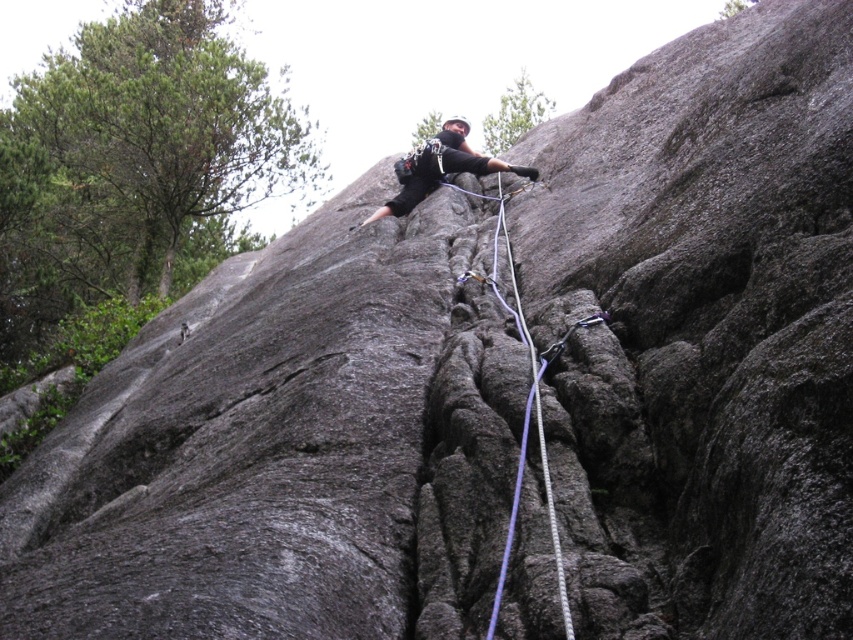
Question: Which point is farther from the camera taking this photo?

Choices:
 (A) (426, 140)
 (B) (538, 435)

Answer: (A)

Question: Is black matte climbing harness at center below purple nylon rope at center-right?

Choices:
 (A) yes
 (B) no

Answer: (B)

Question: In this image, where is black matte climbing harness at center located relative to purple nylon rope at center-right?

Choices:
 (A) left
 (B) right

Answer: (A)

Question: Where is black matte climbing harness at center located in relation to purple nylon rope at center-right in the image?

Choices:
 (A) below
 (B) above

Answer: (B)